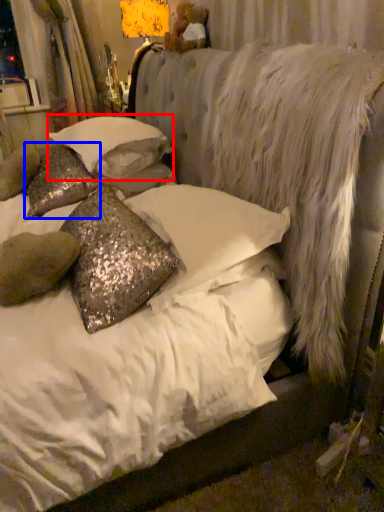
Question: Which object is further to the camera taking this photo, pillow (highlighted by a red box) or pillow (highlighted by a blue box)?

Choices:
 (A) pillow
 (B) pillow

Answer: (B)